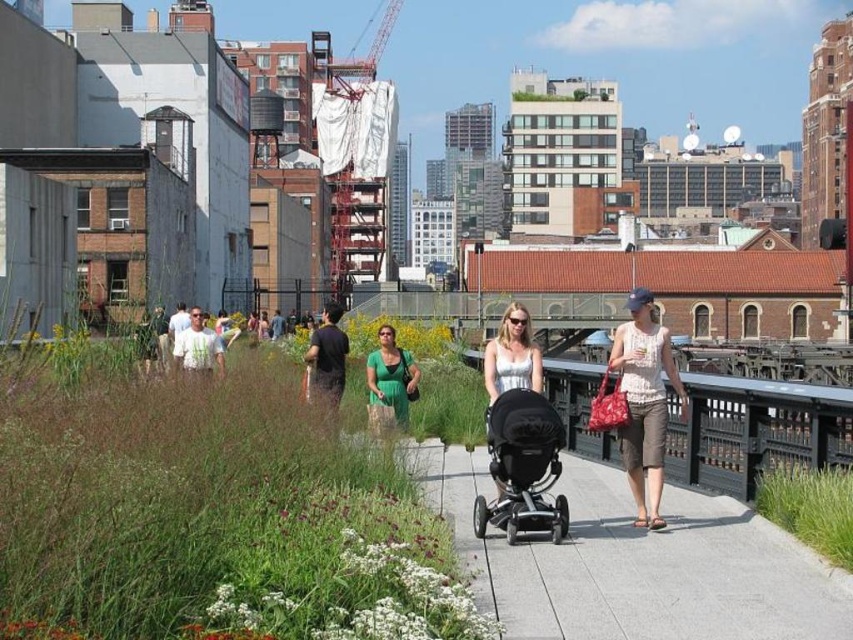
Can you confirm if smooth concrete pavement at center is bigger than green matte dress at center?

Indeed, smooth concrete pavement at center has a larger size compared to green matte dress at center.

What do you see at coordinates (634, 561) in the screenshot?
I see `smooth concrete pavement at center` at bounding box center [634, 561].

Identify the location of smooth concrete pavement at center. The image size is (853, 640). (634, 561).

Does black matte stroller at center appear on the right side of green matte dress at center?

Correct, you'll find black matte stroller at center to the right of green matte dress at center.

Between point (532, 422) and point (370, 372), which one is positioned behind?

Positioned behind is point (370, 372).

This screenshot has width=853, height=640. In order to click on black matte stroller at center in this screenshot , I will do [523, 467].

Which is above, silver metallic dress at center or green matte dress at center?

green matte dress at center is above.

Is silver metallic dress at center smaller than green matte dress at center?

Yes.

Measure the distance between point (495, 381) and camera.

Point (495, 381) and camera are 150.18 feet apart.

Identify the location of silver metallic dress at center. The image size is (853, 640). (512, 355).